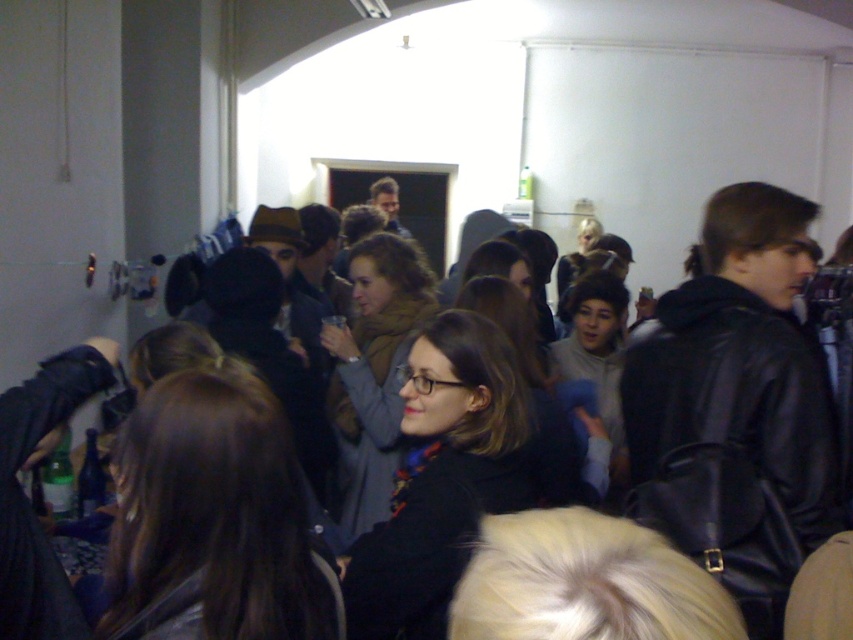
In the scene described, there is a point marked at coordinates (442, 477). This point is associated with an object in the image. What object is located at this point?

The point at (442, 477) marks the location of the matte black coat at center.

You are standing in the room and want to take a photo of the point at coordinates (508, 388). Is this point within the camera frame?

The point at coordinates (508, 388) is 1.74 meters from the camera, so it is likely within the camera frame as it is not too far away.